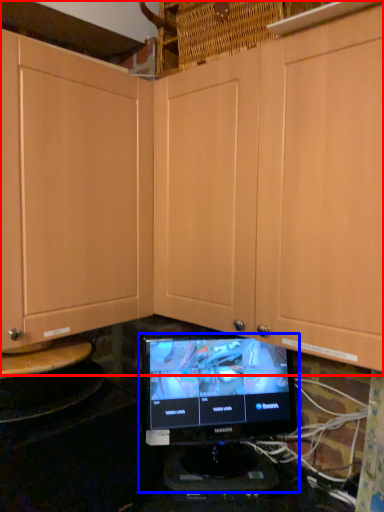
Question: Which of the following is the farthest to the observer, cabinetry (highlighted by a red box) or computer monitor (highlighted by a blue box)?

Choices:
 (A) cabinetry
 (B) computer monitor

Answer: (B)